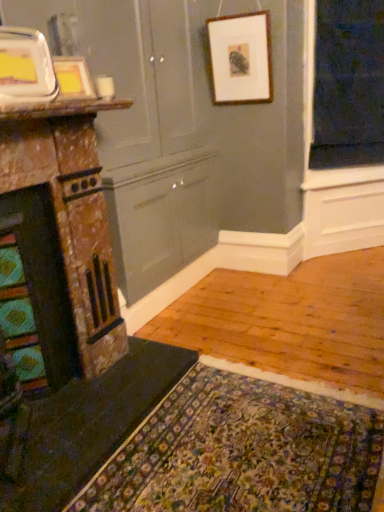
This screenshot has width=384, height=512. What are the coordinates of `free space underneath white marble countertop at upper left (from a real-world perspective)` in the screenshot? It's located at (105, 376).